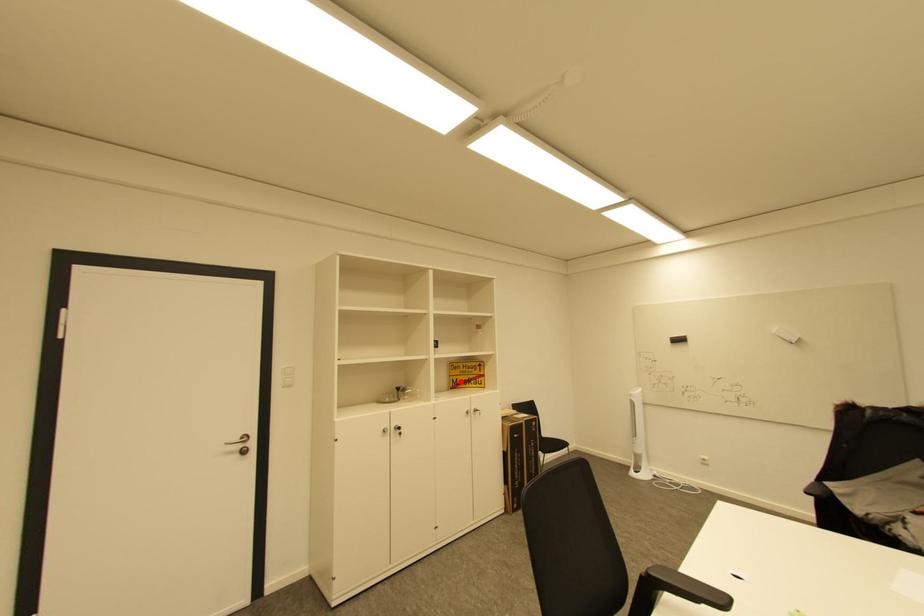
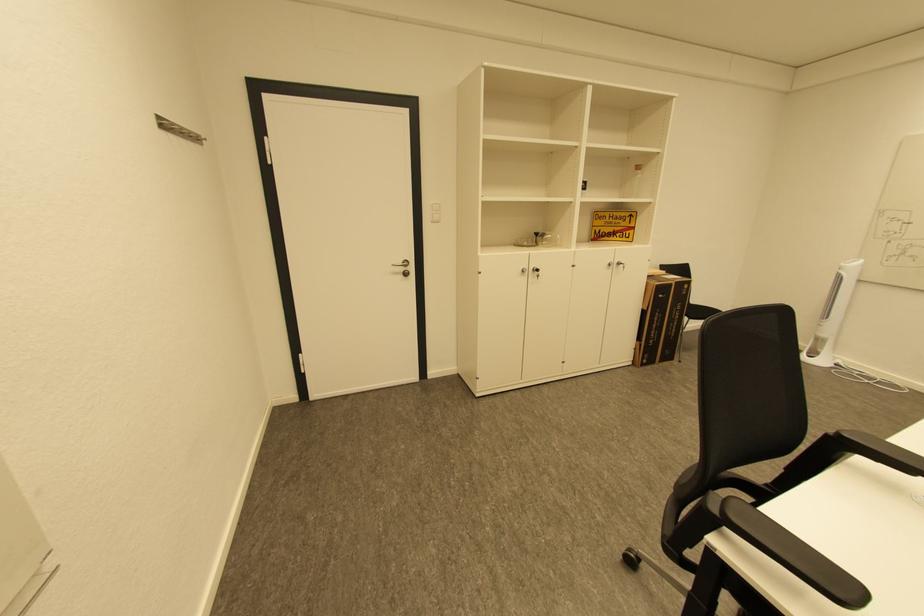
Question: A red point is marked in image1. In image2, is the corresponding 3D point closer to the camera or farther? Reply with the corresponding letter.

Choices:
 (A) The corresponding 3D point is closer.
 (B) The corresponding 3D point is farther.

Answer: (A)